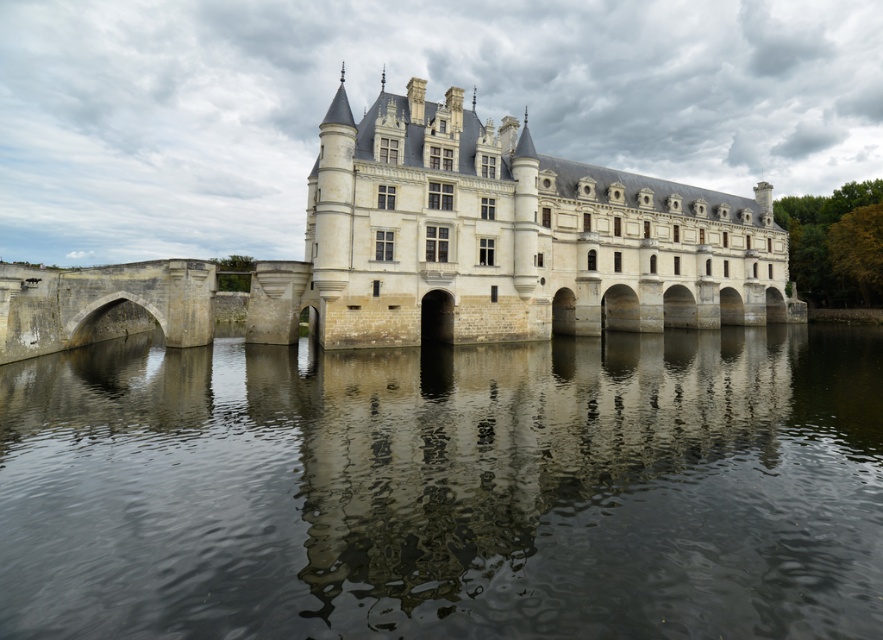
You are a visitor standing on the bridge in front of the stone castle at center. You want to take a photo of the castle with the dark reflective water at center in the background. Which side should you position yourself to ensure the water appears to the left of the castle in your photo?

You should position yourself to the right side of the stone castle at center so that the dark reflective water at center appears to its left in the photo, as described.

You are standing in front of the castle and want to cross to the other side. The dark reflective water at center is in your way. Is there a bridge or pathway visible in the scene that you can use to cross over the water?

The dark reflective water at center is located at point coordinates, but there is no mention of a bridge or pathway in the scene description. Therefore, there is no visible bridge or pathway to cross over the water.

From the picture: You are a tourist standing on the bridge of the castle. You see the dark reflective water at center and the stone castle at center. Which object is closer to you?

The dark reflective water at center is closer to you as it is positioned in front of the stone castle at center.